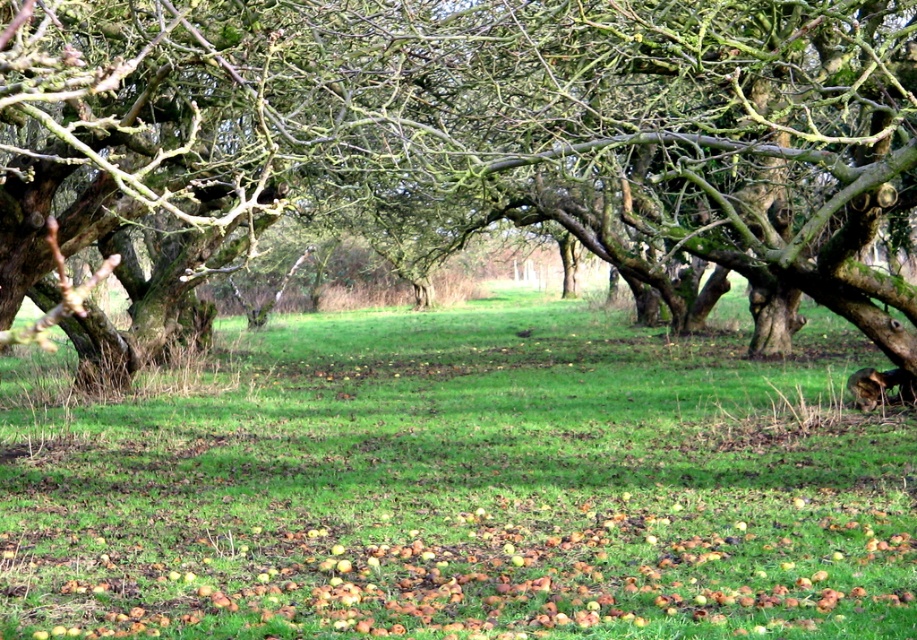
Can you confirm if green grass at center is smaller than brown rough tree at center?

Indeed, green grass at center has a smaller size compared to brown rough tree at center.

Is green grass at center above brown rough tree at center?

Actually, green grass at center is below brown rough tree at center.

Between point (72, 572) and point (796, 122), which one is positioned behind?

The point (796, 122) is behind.

Find the location of a particular element. This screenshot has width=917, height=640. green grass at center is located at coordinates (465, 486).

Does green grass at center appear on the left side of brown rough apples at lower center?

Incorrect, green grass at center is not on the left side of brown rough apples at lower center.

Does point (870, 600) come behind point (587, 579)?

That is False.

Identify the location of green grass at center. Image resolution: width=917 pixels, height=640 pixels. (465, 486).

Looking at this image, can you confirm if brown rough tree at center is shorter than brown rough apples at lower center?

In fact, brown rough tree at center may be taller than brown rough apples at lower center.

Does brown rough tree at center appear over brown rough apples at lower center?

Correct, brown rough tree at center is located above brown rough apples at lower center.

Identify the location of brown rough tree at center. (521, 128).